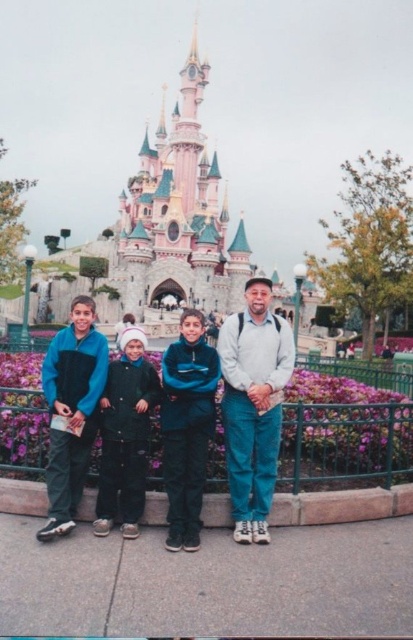
Is blue fleece jacket at center behind light gray sweater at center?

No, it is not.

Who is more forward, (206, 346) or (234, 317)?

Point (206, 346)

What are the coordinates of `blue fleece jacket at center` in the screenshot? It's located at (227, 413).